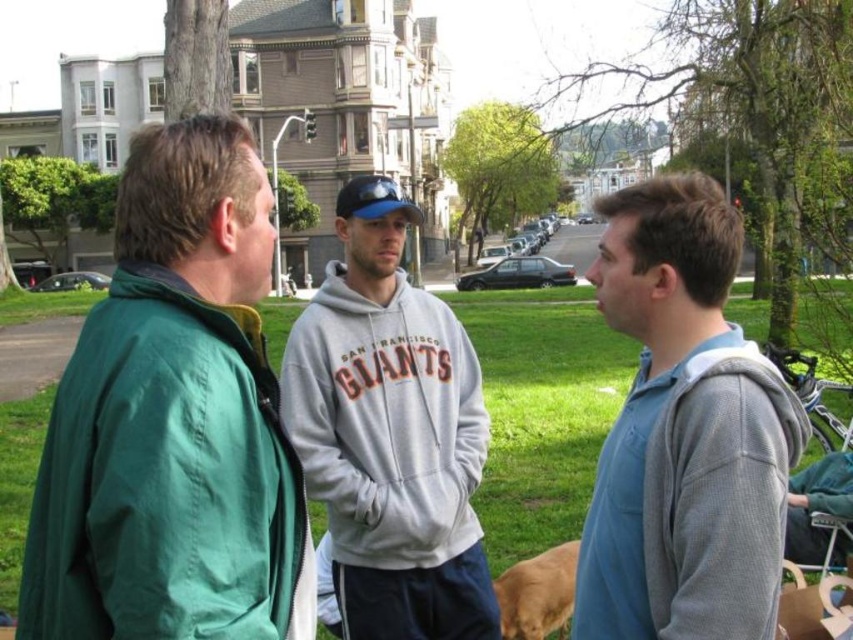
Question: Does gray fleece jacket at center have a larger size compared to golden fur dog at lower center?

Choices:
 (A) no
 (B) yes

Answer: (B)

Question: Can you confirm if green matte jacket at left is wider than gray fleece sweatshirt at center?

Choices:
 (A) yes
 (B) no

Answer: (A)

Question: Which point is farther to the camera?

Choices:
 (A) golden fur dog at lower center
 (B) gray fleece jacket at center
 (C) gray fleece sweatshirt at center

Answer: (A)

Question: Is green matte jacket at left positioned in front of golden fur dog at lower center?

Choices:
 (A) no
 (B) yes

Answer: (B)

Question: Which point is closer to the camera?

Choices:
 (A) (173, 394)
 (B) (712, 301)

Answer: (A)

Question: Which point is closer to the camera?

Choices:
 (A) green matte jacket at left
 (B) gray fleece sweatshirt at center
 (C) gray fleece jacket at center
 (D) golden fur dog at lower center

Answer: (A)